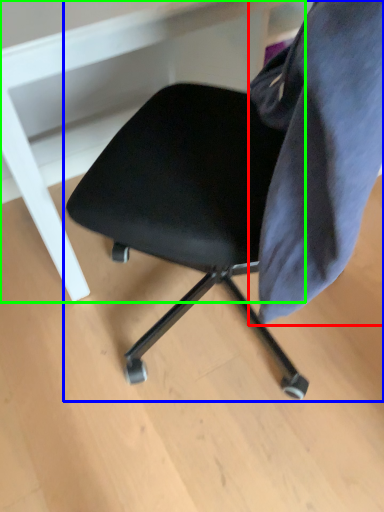
Question: Considering the real-world distances, which object is closest to fabric (highlighted by a red box)? chair (highlighted by a blue box) or vanity (highlighted by a green box).

Choices:
 (A) chair
 (B) vanity

Answer: (A)